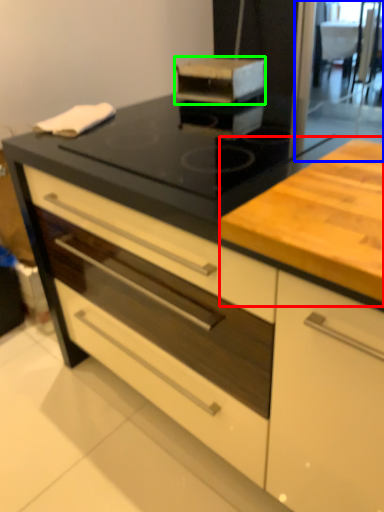
Question: Which object is the farthest from counter (highlighted by a red box)? Choose among these: screen door (highlighted by a blue box) or kitchen appliance (highlighted by a green box).

Choices:
 (A) screen door
 (B) kitchen appliance

Answer: (A)